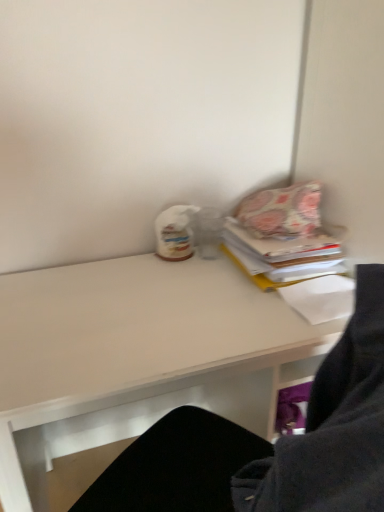
Question: Based on their positions, is floral fabric pillow at upper right located to the left or right of patterned fabric book at upper right?

Choices:
 (A) right
 (B) left

Answer: (B)

Question: Considering the positions of point (301, 214) and point (294, 249), is point (301, 214) closer or farther from the camera than point (294, 249)?

Choices:
 (A) closer
 (B) farther

Answer: (B)

Question: Which object is the farthest from the floral fabric pillow at upper right?

Choices:
 (A) white matte desk at center
 (B) patterned fabric book at upper right

Answer: (A)

Question: Which object is positioned closest to the white matte desk at center?

Choices:
 (A) patterned fabric book at upper right
 (B) floral fabric pillow at upper right

Answer: (A)